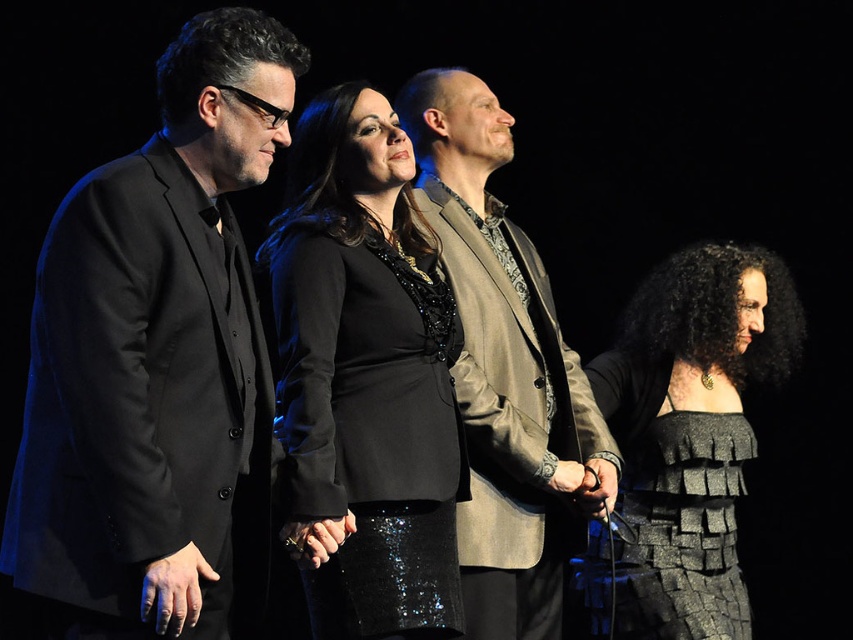
Based on the coordinates provided, which object is located at point (505, 372) in the image?

The point (505, 372) marks the shiny beige suit at center.

Based on the scene description, which object is positioned to the left of the other between the shiny beige suit at center and the textured gray dress at lower right?

The shiny beige suit at center is positioned to the left of the textured gray dress at lower right.

What are the coordinates of the black sequined dress at center?

The black sequined dress at center is located at coordinates point (364, 378).